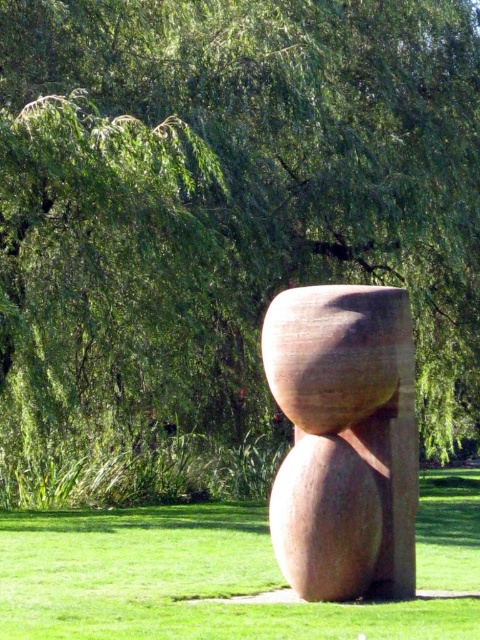
Does green grass at lower center appear on the right side of matte brown stone sculpture at center?

In fact, green grass at lower center is to the left of matte brown stone sculpture at center.

Does green grass at lower center appear on the left side of matte brown stone sculpture at center?

Yes, green grass at lower center is to the left of matte brown stone sculpture at center.

Is point (11, 616) positioned after point (375, 403)?

No, (11, 616) is closer to viewer.

The height and width of the screenshot is (640, 480). Identify the location of green grass at lower center. (179, 580).